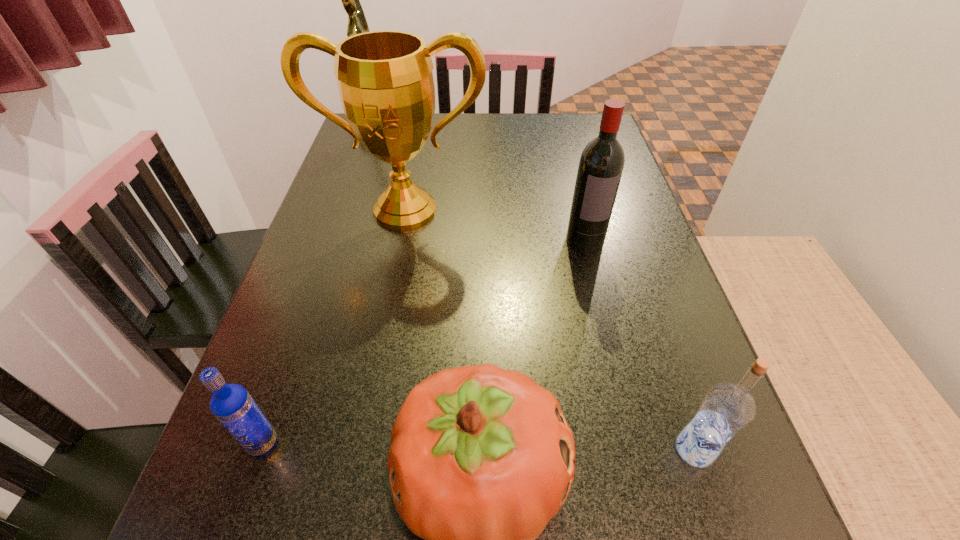
What are the coordinates of `free location located on the left of the rightmost object` in the screenshot? It's located at (615, 449).

Where is `free space located 0.140m on the right of the shorter vodka`? free space located 0.140m on the right of the shorter vodka is located at coordinates (371, 443).

Find the location of a particular element. This screenshot has height=540, width=960. object that is at the far edge is located at coordinates (357, 23).

Image resolution: width=960 pixels, height=540 pixels. Find the location of `vodka that is at the left edge`. vodka that is at the left edge is located at coordinates (231, 404).

You are a GUI agent. You are given a task and a screenshot of the screen. Output one action in this format:
    pyautogui.click(x=<x>, y=<y>)
    Task: Click on the wine bottle at the right edge
    This screenshot has width=960, height=540.
    Given the screenshot: What is the action you would take?
    pyautogui.click(x=601, y=164)

Find the location of a particular element. The image size is (960, 540). vodka that is positioned at the right edge is located at coordinates (727, 408).

At what (x,y) coordinates should I click in order to perform the action: click on object present at the far left corner. Please return your answer as a coordinate pair (x, y). Looking at the image, I should click on (357, 23).

Locate an element on the screen. free spot at the far edge of the desktop is located at coordinates (512, 113).

Find the location of `vacant space at the left edge of the desktop`. vacant space at the left edge of the desktop is located at coordinates (214, 471).

Where is `vacant area at the right edge`? This screenshot has height=540, width=960. vacant area at the right edge is located at coordinates (596, 295).